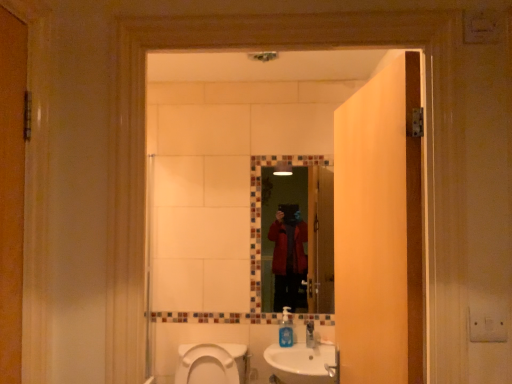
Question: Can you confirm if blue translucent soap dispenser at lower center is bigger than glass mosaic mirror at center?

Choices:
 (A) yes
 (B) no

Answer: (B)

Question: From a real-world perspective, is blue translucent soap dispenser at lower center below glass mosaic mirror at center?

Choices:
 (A) no
 (B) yes

Answer: (B)

Question: Considering the relative sizes of blue translucent soap dispenser at lower center and glass mosaic mirror at center in the image provided, is blue translucent soap dispenser at lower center wider than glass mosaic mirror at center?

Choices:
 (A) yes
 (B) no

Answer: (A)

Question: Is blue translucent soap dispenser at lower center further to camera compared to glass mosaic mirror at center?

Choices:
 (A) no
 (B) yes

Answer: (A)

Question: From the image's perspective, is blue translucent soap dispenser at lower center above glass mosaic mirror at center?

Choices:
 (A) yes
 (B) no

Answer: (B)

Question: Looking at their shapes, would you say white ceramic sink at lower center is wider or thinner than wooden door at center?

Choices:
 (A) wide
 (B) thin

Answer: (A)

Question: Considering the positions of point pos(287,360) and point pos(382,289), is point pos(287,360) closer or farther from the camera than point pos(382,289)?

Choices:
 (A) closer
 (B) farther

Answer: (B)

Question: Is white ceramic sink at lower center taller or shorter than wooden door at center?

Choices:
 (A) short
 (B) tall

Answer: (A)

Question: Is white ceramic sink at lower center in front of or behind wooden door at center in the image?

Choices:
 (A) behind
 (B) front

Answer: (A)

Question: Relative to white ceramic sink at lower center, is white glossy toilet at lower center in front or behind?

Choices:
 (A) behind
 (B) front

Answer: (B)

Question: Is white glossy toilet at lower center taller or shorter than white ceramic sink at lower center?

Choices:
 (A) tall
 (B) short

Answer: (B)

Question: Considering the positions of white glossy toilet at lower center and white ceramic sink at lower center in the image, is white glossy toilet at lower center wider or thinner than white ceramic sink at lower center?

Choices:
 (A) wide
 (B) thin

Answer: (A)

Question: Is white glossy toilet at lower center inside or outside of white ceramic sink at lower center?

Choices:
 (A) inside
 (B) outside

Answer: (B)

Question: Looking at their shapes, would you say glass mosaic mirror at center is wider or thinner than blue translucent soap dispenser at lower center?

Choices:
 (A) thin
 (B) wide

Answer: (A)

Question: Is glass mosaic mirror at center in front of or behind blue translucent soap dispenser at lower center in the image?

Choices:
 (A) front
 (B) behind

Answer: (B)